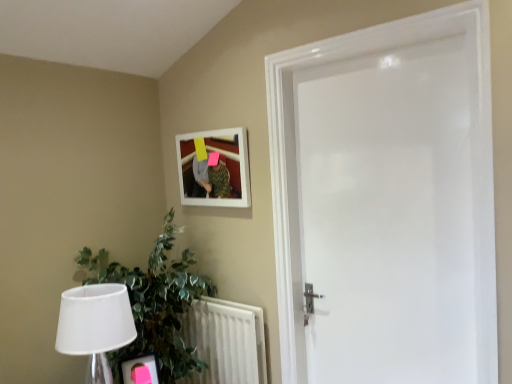
Question: Considering the positions of point (203, 173) and point (90, 344), is point (203, 173) closer or farther from the camera than point (90, 344)?

Choices:
 (A) farther
 (B) closer

Answer: (A)

Question: Choose the correct answer: Is white matte picture frame at upper center inside white fabric lampshade at lower left or outside it?

Choices:
 (A) outside
 (B) inside

Answer: (A)

Question: Considering the real-world distances, which object is farthest from the white glossy door at center?

Choices:
 (A) green leafy plant at lower left
 (B) white textured radiator at lower left
 (C) white matte picture frame at upper center
 (D) white fabric lampshade at lower left

Answer: (D)

Question: Based on their relative distances, which object is farther from the green leafy plant at lower left?

Choices:
 (A) white textured radiator at lower left
 (B) white matte picture frame at upper center
 (C) white glossy door at center
 (D) white fabric lampshade at lower left

Answer: (C)